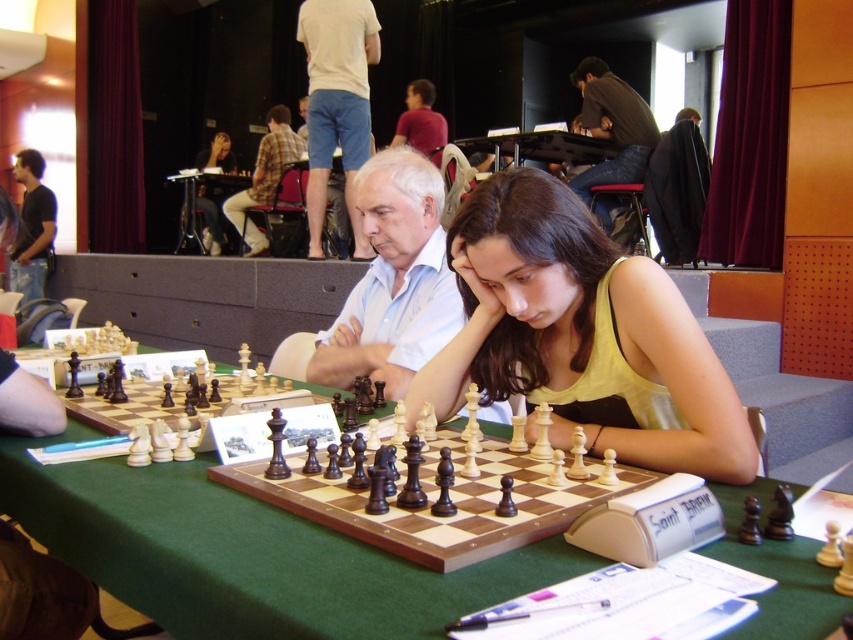
Which of these two, white shirt at center or matte black chessboard at upper center, stands shorter?

matte black chessboard at upper center

Consider the image. Who is more distant from viewer, (428, 278) or (216, 136)?

Positioned behind is point (216, 136).

Is point (401, 300) in front of point (207, 250)?

Yes, it is in front of point (207, 250).

At what (x,y) coordinates should I click in order to perform the action: click on white shirt at center. Please return your answer as a coordinate pair (x, y). The image size is (853, 640). Looking at the image, I should click on (393, 280).

Is yellow fabric shirt at center below black t-shirt at left?

Yes, yellow fabric shirt at center is below black t-shirt at left.

Is the position of yellow fabric shirt at center more distant than that of black t-shirt at left?

No.

Between point (488, 381) and point (9, 260), which one is positioned in front?

Point (488, 381) is more forward.

Where is `yellow fabric shirt at center`? yellow fabric shirt at center is located at coordinates (579, 336).

Can you confirm if yellow fabric shirt at center is positioned to the right of matte black chessboard at upper center?

Yes, yellow fabric shirt at center is to the right of matte black chessboard at upper center.

Is yellow fabric shirt at center further to camera compared to matte black chessboard at upper center?

No, it is not.

Is point (419, 404) behind point (230, 164)?

No, (419, 404) is closer to viewer.

The width and height of the screenshot is (853, 640). I want to click on yellow fabric shirt at center, so click(579, 336).